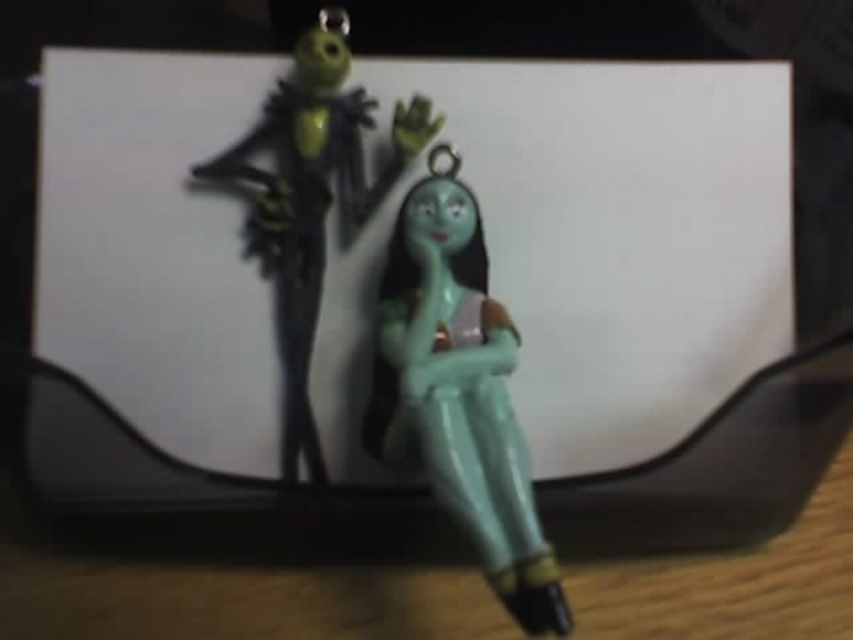
You are looking at two figures on a white background. The teal glossy figure at center and the matte green figure at center are both present. Which one is positioned to the right?

The teal glossy figure at center is positioned to the right of the matte green figure at center.

Based on the photo, you are an artist trying to sketch the scene. You need to place the teal glossy figure at center in your drawing. Where should you position it on the grid? The grid has coordinates from 0 to 1 on both axes.

The teal glossy figure at center should be positioned at coordinates approximately 0.614 on the x axis and 0.538 on the y axis.